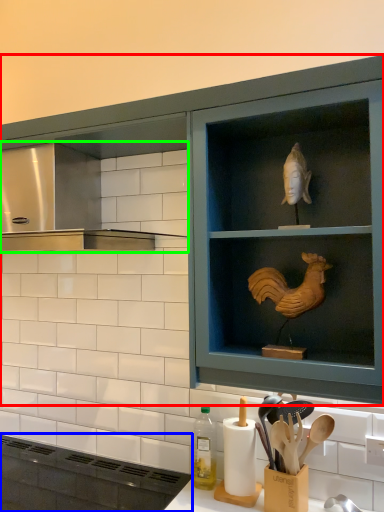
Question: Based on their relative distances, which object is nearer to cabinetry (highlighted by a red box)? Choose from appliance (highlighted by a blue box) and vent (highlighted by a green box).

Choices:
 (A) appliance
 (B) vent

Answer: (A)